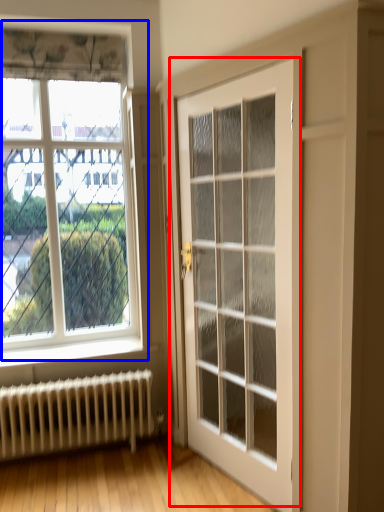
Question: Which object appears farthest to the camera in this image, door (highlighted by a red box) or window (highlighted by a blue box)?

Choices:
 (A) door
 (B) window

Answer: (B)